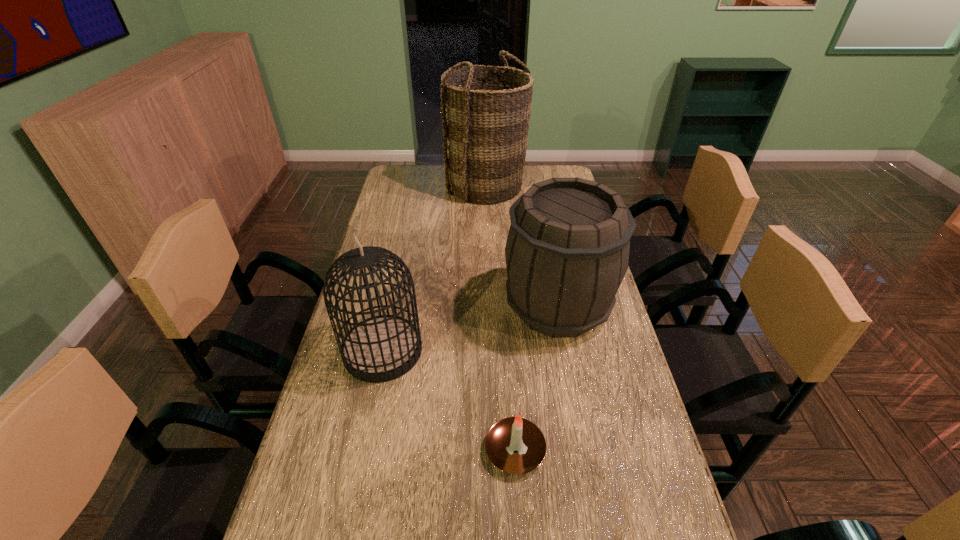
Locate an element on the screen. The height and width of the screenshot is (540, 960). the tallest object is located at coordinates (485, 117).

Where is `the farthest object`? The height and width of the screenshot is (540, 960). the farthest object is located at coordinates (485, 117).

I want to click on birdcage, so click(382, 348).

The width and height of the screenshot is (960, 540). I want to click on wine bucket, so click(x=567, y=251).

Where is `the shortest object`? the shortest object is located at coordinates (515, 445).

Where is `the nearest object`? This screenshot has height=540, width=960. the nearest object is located at coordinates (515, 445).

This screenshot has height=540, width=960. I want to click on vacant region located 0.190m on the right of the tallest object, so click(572, 185).

At what (x,y) coordinates should I click in order to perform the action: click on vacant region located on the back of the birdcage. Please return your answer as a coordinate pair (x, y). This screenshot has height=540, width=960. Looking at the image, I should click on (396, 286).

Locate an element on the screen. The height and width of the screenshot is (540, 960). free location located 0.230m on the left of the wine bucket is located at coordinates (424, 306).

Find the location of a particular element. free region located on the left of the candle is located at coordinates (356, 450).